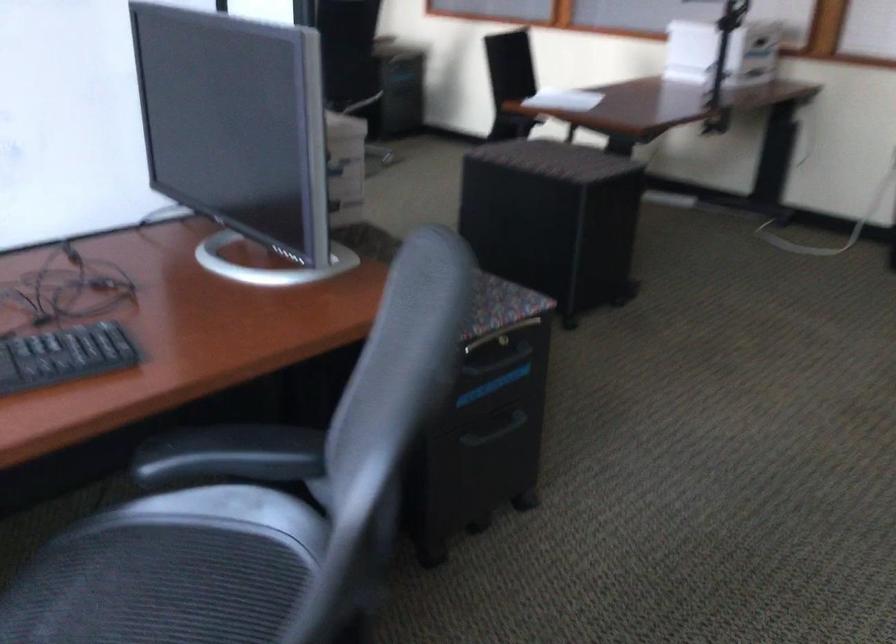
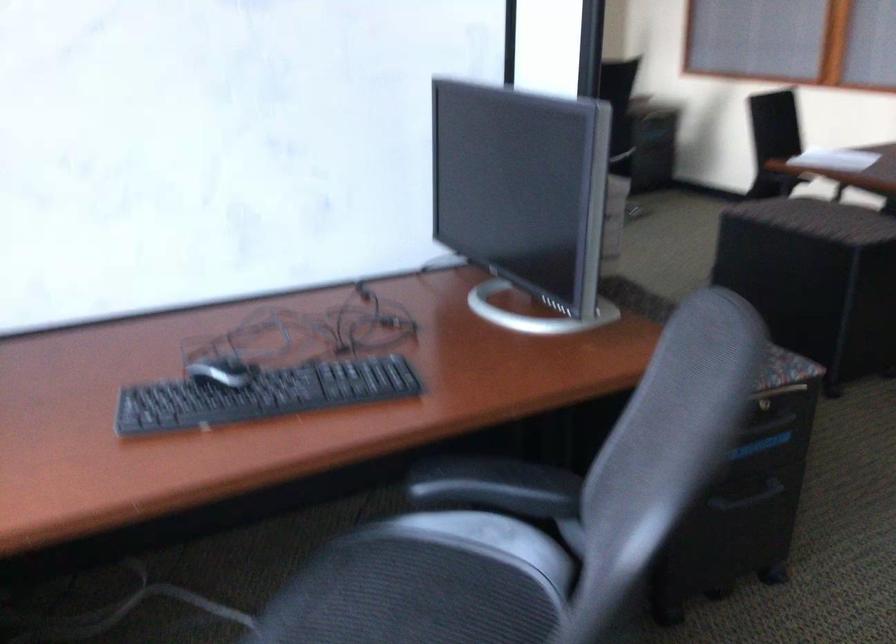
In the second image, find the point that corresponds to point (489, 435) in the first image.

(747, 497)